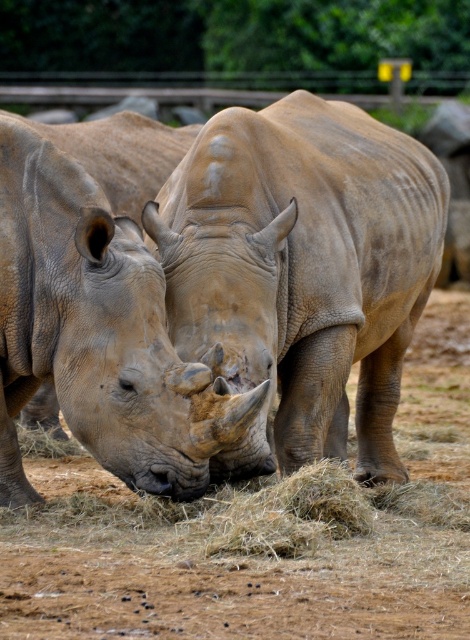
You are a zookeeper who needs to transport both the brown dirt field at center and the smooth beige rhino at center to a new enclosure. The transport vehicle has a maximum width capacity of 3 meters. Based on the scene description, can both objects fit side by side in the vehicle?

The brown dirt field at center is wider than the smooth beige rhino at center. However, since the exact widths are not provided, it is impossible to determine if their combined width exceeds the vehicle capacity of 3 meters.

Consider the image. You are a zookeeper trying to guide the smooth beige rhino at center to the brown dirt field at center. Based on their positions, can you determine if the rhino is already standing on the field?

The brown dirt field at center is below the smooth beige rhino at center, so the rhino is standing on the field.

You are a zookeeper trying to feed the smooth beige rhino at left. You have a bucket of food placed on the brown dirt field at center. Can you directly see the bucket from where the rhino is standing?

The brown dirt field at center is in front of the smooth beige rhino at left, so yes, the zookeeper can directly see the bucket placed on the brown dirt field at center from the rhino.